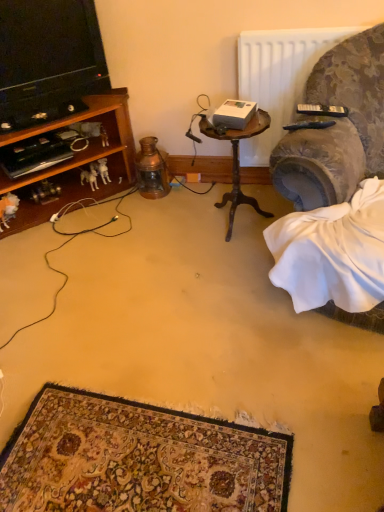
Question: From the image's perspective, is black cable at left above or below velvet fabric couch at right?

Choices:
 (A) above
 (B) below

Answer: (B)

Question: In the image, is black cable at left on the left side or the right side of velvet fabric couch at right?

Choices:
 (A) left
 (B) right

Answer: (A)

Question: Which of these objects is positioned farthest from the black cable at left?

Choices:
 (A) velvet fabric couch at right
 (B) white fabric at lower right
 (C) black plastic remote control at upper right, which ranks as the 2th remote control in top-to-bottom order
 (D) wooden table at center
 (E) white plastic dog at lower left

Answer: (A)

Question: Based on their relative distances, which object is farther from the black plastic remote control at upper right, the 2th remote control positioned from the bottom?

Choices:
 (A) black cable at left
 (B) wooden table at center
 (C) velvet fabric couch at right
 (D) black plastic remote control at upper right, placed as the 1th remote control when sorted from front to back
 (E) white fabric at lower right

Answer: (A)